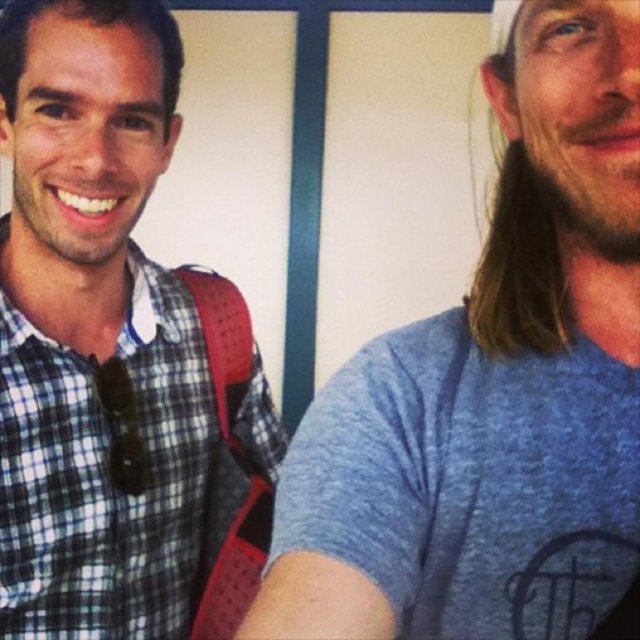
Question: Is the position of blue cotton t-shirt at right more distant than that of beardsoft hair at left?

Choices:
 (A) no
 (B) yes

Answer: (A)

Question: Which of these objects is positioned closest to the blue cotton t-shirt at right?

Choices:
 (A) brown fuzzy beard at right
 (B) checkered fabric shirt at left
 (C) beardsoft hair at left

Answer: (A)

Question: Is checkered fabric shirt at left below beardsoft hair at left?

Choices:
 (A) no
 (B) yes

Answer: (B)

Question: Which of the following is the closest to the observer?

Choices:
 (A) (134, 632)
 (B) (612, 186)
 (C) (77, 164)
 (D) (548, 369)

Answer: (B)

Question: Based on their relative distances, which object is nearer to the checkered fabric shirt at left?

Choices:
 (A) beardsoft hair at left
 (B) brown fuzzy beard at right
 (C) blue cotton t-shirt at right

Answer: (A)

Question: Can you confirm if checkered fabric shirt at left is bigger than brown fuzzy beard at right?

Choices:
 (A) no
 (B) yes

Answer: (B)